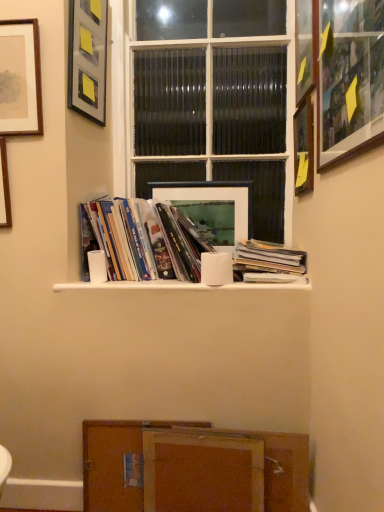
Measure the distance between matte black picture frame at upper left, acting as the sixth picture frame starting from the right, and camera.

A distance of 1.39 meters exists between matte black picture frame at upper left, acting as the sixth picture frame starting from the right, and camera.

Image resolution: width=384 pixels, height=512 pixels. What do you see at coordinates (20, 78) in the screenshot?
I see `matte black picture frame at upper left, acting as the second picture frame starting from the left` at bounding box center [20, 78].

What do you see at coordinates (88, 58) in the screenshot?
I see `metallic gray picture frame at upper left, arranged as the third picture frame when viewed from the left` at bounding box center [88, 58].

What is the approximate height of matte paper stack of books at center, which is the 1th book in right-to-left order?

5.67 inches.

This screenshot has height=512, width=384. I want to click on wooden picture frame at left, the 7th picture frame in the right-to-left sequence, so click(4, 188).

Measure the distance between point (185, 288) and camera.

Point (185, 288) and camera are 1.41 meters apart.

The height and width of the screenshot is (512, 384). What do you see at coordinates (142, 241) in the screenshot? I see `hardcover books at center, which ranks as the 2th book in right-to-left order` at bounding box center [142, 241].

What are the coordinates of `matte black picture frame at upper left, acting as the sixth picture frame starting from the right` in the screenshot? It's located at (20, 78).

From a real-world perspective, is metallic gray picture frame at upper left, arranged as the third picture frame when viewed from the left, under matte black picture frame at center, the 4th picture frame when ordered from right to left?

Incorrect, from a real-world perspective, metallic gray picture frame at upper left, arranged as the third picture frame when viewed from the left, is higher than matte black picture frame at center, the 4th picture frame when ordered from right to left.

From the image's perspective, is metallic gray picture frame at upper left, which is counted as the fifth picture frame, starting from the right, under matte black picture frame at center, which is counted as the 4th picture frame, starting from the left?

No, from the image's perspective, metallic gray picture frame at upper left, which is counted as the fifth picture frame, starting from the right, is not below matte black picture frame at center, which is counted as the 4th picture frame, starting from the left.

Between point (76, 49) and point (250, 213), which one is positioned behind?

Positioned behind is point (250, 213).

Based on their sizes in the image, would you say metallic gray picture frame at upper left, which is counted as the fifth picture frame, starting from the right, is bigger or smaller than matte black picture frame at center, which is counted as the 4th picture frame, starting from the left?

metallic gray picture frame at upper left, which is counted as the fifth picture frame, starting from the right, is bigger than matte black picture frame at center, which is counted as the 4th picture frame, starting from the left.

Between matte paper stack of books at center, which is the 1th book in right-to-left order, and matte black picture frame at center, the 4th picture frame when ordered from right to left, which one has larger width?

With larger width is matte paper stack of books at center, which is the 1th book in right-to-left order.

Is matte paper stack of books at center, which is the 1th book in right-to-left order, turned away from matte black picture frame at center, the 4th picture frame when ordered from right to left?

No, matte paper stack of books at center, which is the 1th book in right-to-left order, is not facing the opposite direction of matte black picture frame at center, the 4th picture frame when ordered from right to left.

From a real-world perspective, which is physically above, matte paper stack of books at center, arranged as the 2th book when viewed from the left, or matte black picture frame at center, which is counted as the 4th picture frame, starting from the left?

In real-world perspective, matte black picture frame at center, which is counted as the 4th picture frame, starting from the left, is above.

Is matte paper stack of books at center, which is the 1th book in right-to-left order, shorter than matte black picture frame at center, the 4th picture frame when ordered from right to left?

Yes, matte paper stack of books at center, which is the 1th book in right-to-left order, is shorter than matte black picture frame at center, the 4th picture frame when ordered from right to left.

Considering the positions of objects hardcover books at center, which ranks as the 2th book in right-to-left order, and white matte shelf at center in the image provided, who is in front, hardcover books at center, which ranks as the 2th book in right-to-left order, or white matte shelf at center?

white matte shelf at center is closer to the camera.

This screenshot has height=512, width=384. Identify the location of the 2nd book above the white matte shelf at center (from the image's perspective). (142, 241).

Which is less distant, (120, 206) or (155, 280)?

Clearly, point (120, 206) is more distant from the camera than point (155, 280).

Considering the sizes of objects hardcover books at center, which ranks as the 2th book in right-to-left order, and white matte shelf at center in the image provided, who is bigger, hardcover books at center, which ranks as the 2th book in right-to-left order, or white matte shelf at center?

hardcover books at center, which ranks as the 2th book in right-to-left order, is bigger.

Considering the relative sizes of matte black picture frame at center, the 4th picture frame when ordered from right to left, and wooden picture frame at upper right, which appears as the fifth picture frame when viewed from the left, in the image provided, is matte black picture frame at center, the 4th picture frame when ordered from right to left, smaller than wooden picture frame at upper right, which appears as the fifth picture frame when viewed from the left,?

Correct, matte black picture frame at center, the 4th picture frame when ordered from right to left, occupies less space than wooden picture frame at upper right, which appears as the fifth picture frame when viewed from the left.

Is matte black picture frame at center, the 4th picture frame when ordered from right to left, outside of wooden picture frame at upper right, which appears as the fifth picture frame when viewed from the left?

Yes, matte black picture frame at center, the 4th picture frame when ordered from right to left, is not within wooden picture frame at upper right, which appears as the fifth picture frame when viewed from the left.

Could you measure the distance between matte black picture frame at center, which is counted as the 4th picture frame, starting from the left, and wooden picture frame at upper right, which appears as the fifth picture frame when viewed from the left?

They are 27.97 inches apart.

Does point (205, 208) come closer to viewer compared to point (335, 0)?

No, it is not.

Which is correct: matte glass window at center is inside matte black picture frame at center, which is counted as the 4th picture frame, starting from the left, or outside of it?

matte glass window at center lies outside matte black picture frame at center, which is counted as the 4th picture frame, starting from the left.

Considering the positions of objects matte glass window at center and matte black picture frame at center, which is counted as the 4th picture frame, starting from the left, in the image provided, who is more to the right, matte glass window at center or matte black picture frame at center, which is counted as the 4th picture frame, starting from the left,?

matte glass window at center.

Where is `window in front of the matte black picture frame at center, which is counted as the 4th picture frame, starting from the left`? The width and height of the screenshot is (384, 512). window in front of the matte black picture frame at center, which is counted as the 4th picture frame, starting from the left is located at coordinates (211, 100).

Based on the photo, is matte glass window at center wider than matte black picture frame at center, the 4th picture frame when ordered from right to left?

Yes.

Is matte black picture frame at upper left, acting as the sixth picture frame starting from the right, touching metallic gray picture frame at upper left, arranged as the third picture frame when viewed from the left?

matte black picture frame at upper left, acting as the sixth picture frame starting from the right, and metallic gray picture frame at upper left, arranged as the third picture frame when viewed from the left, are clearly separated.

Looking at this image, from a real-world perspective, is matte black picture frame at upper left, acting as the second picture frame starting from the left, positioned under metallic gray picture frame at upper left, which is counted as the fifth picture frame, starting from the right, based on gravity?

Indeed, from a real-world perspective, matte black picture frame at upper left, acting as the second picture frame starting from the left, is positioned beneath metallic gray picture frame at upper left, which is counted as the fifth picture frame, starting from the right.

Looking at this image, from the image's perspective, which is above, wooden cabinet at lower center or hardcover books at center, which ranks as the 2th book in right-to-left order?

hardcover books at center, which ranks as the 2th book in right-to-left order, from the image's perspective.

Can you confirm if wooden cabinet at lower center is bigger than hardcover books at center, which ranks as the 2th book in right-to-left order?

No.

Consider the image. Considering the sizes of wooden cabinet at lower center and hardcover books at center, which ranks as the 2th book in right-to-left order, in the image, is wooden cabinet at lower center wider or thinner than hardcover books at center, which ranks as the 2th book in right-to-left order,?

wooden cabinet at lower center is thinner than hardcover books at center, which ranks as the 2th book in right-to-left order.

Considering the positions of point (273, 490) and point (145, 210), is point (273, 490) closer or farther from the camera than point (145, 210)?

Point (273, 490) appears to be closer to the viewer than point (145, 210).

You are a GUI agent. You are given a task and a screenshot of the screen. Output one action in this format:
    pyautogui.click(x=<x>, y=<y>)
    Task: Click on the picture frame that is the 2nd object located behind the metallic gray picture frame at upper left, arranged as the third picture frame when viewed from the left
    
    Given the screenshot: What is the action you would take?
    pyautogui.click(x=211, y=207)

This screenshot has height=512, width=384. What are the coordinates of `book lying on the right of matte black picture frame at center, the 4th picture frame when ordered from right to left` in the screenshot? It's located at (270, 258).

Looking at the image, which one is located closer to matte paper stack of books at center, which is the 1th book in right-to-left order, metallic gray picture frame at upper left, which is counted as the fifth picture frame, starting from the right, or wooden picture frame at upper right, which is counted as the seventh picture frame, starting from the left?

Among the two, wooden picture frame at upper right, which is counted as the seventh picture frame, starting from the left, is located nearer to matte paper stack of books at center, which is the 1th book in right-to-left order.

When comparing their distances from matte glass window at center, does wooden picture frame at upper right, the first picture frame positioned from the right, or matte paper stack of books at center, which is the 1th book in right-to-left order, seem further?

Among the two, matte paper stack of books at center, which is the 1th book in right-to-left order, is located further to matte glass window at center.

When comparing their distances from matte glass window at center, does wooden cabinet at lower center or matte black picture frame at upper left, acting as the sixth picture frame starting from the right, seem further?

The object further to matte glass window at center is wooden cabinet at lower center.

Based on their spatial positions, is brown wood cabinet at lower center or wooden picture frame at left, the 7th picture frame in the right-to-left sequence, further from hardcover books at center, which ranks as the 2th book in right-to-left order?

Based on the image, brown wood cabinet at lower center appears to be further to hardcover books at center, which ranks as the 2th book in right-to-left order.

From the image, which object appears to be nearer to matte black picture frame at center, the 4th picture frame when ordered from right to left, matte paper stack of books at center, which is the 1th book in right-to-left order, or hardcover books at center, which ranks as the 2th book in right-to-left order?

The object closer to matte black picture frame at center, the 4th picture frame when ordered from right to left, is hardcover books at center, which ranks as the 2th book in right-to-left order.

Which object lies further to the anchor point matte black picture frame at upper left, acting as the sixth picture frame starting from the right, wooden picture frame at upper right, which appears as the fifth picture frame when viewed from the left, or white matte shelf at center?

wooden picture frame at upper right, which appears as the fifth picture frame when viewed from the left, lies further to matte black picture frame at upper left, acting as the sixth picture frame starting from the right, than the other object.

Estimate the real-world distances between objects in this image. Which object is further from matte black picture frame at center, which is counted as the 4th picture frame, starting from the left, wooden cabinet at lower center or brown wood cabinet at lower center?

brown wood cabinet at lower center is positioned further to the anchor matte black picture frame at center, which is counted as the 4th picture frame, starting from the left.

Estimate the real-world distances between objects in this image. Which object is closer to metallic gray picture frame at upper left, arranged as the third picture frame when viewed from the left, brown wood cabinet at lower center or matte black picture frame at center, the 4th picture frame when ordered from right to left?

matte black picture frame at center, the 4th picture frame when ordered from right to left, is positioned closer to the anchor metallic gray picture frame at upper left, arranged as the third picture frame when viewed from the left.

Where is `cabinet between wooden picture frame at left, which ranks as the 1th picture frame in left-to-right order, and wooden picture frame at upper right, the first picture frame positioned from the right`? Image resolution: width=384 pixels, height=512 pixels. cabinet between wooden picture frame at left, which ranks as the 1th picture frame in left-to-right order, and wooden picture frame at upper right, the first picture frame positioned from the right is located at coordinates tap(202, 472).

You are a GUI agent. You are given a task and a screenshot of the screen. Output one action in this format:
    pyautogui.click(x=<x>, y=<y>)
    Task: Click on the window between wooden picture frame at upper right, positioned as the second picture frame in right-to-left order, and white matte shelf at center vertically
    Image resolution: width=384 pixels, height=512 pixels.
    Given the screenshot: What is the action you would take?
    pyautogui.click(x=211, y=100)

The width and height of the screenshot is (384, 512). Identify the location of window between wooden picture frame at left, which ranks as the 1th picture frame in left-to-right order, and matte paper stack of books at center, which is the 1th book in right-to-left order, from left to right. (211, 100).

You are a GUI agent. You are given a task and a screenshot of the screen. Output one action in this format:
    pyautogui.click(x=<x>, y=<y>)
    Task: Click on the window between metallic gray picture frame at upper left, which is counted as the fifth picture frame, starting from the right, and matte black picture frame at center, the 4th picture frame when ordered from right to left, from top to bottom
    The width and height of the screenshot is (384, 512).
    Given the screenshot: What is the action you would take?
    pyautogui.click(x=211, y=100)